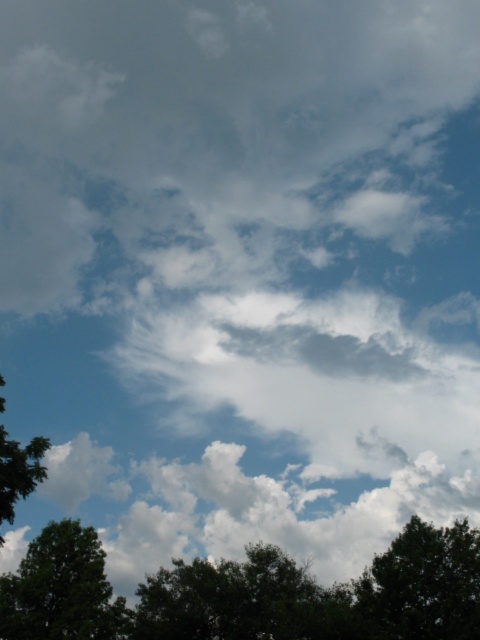
You are standing in a field looking up at the sky. You notice two green leafy trees in the distance. One is labeled as the green leafy tree at lower left and the other as the green leafy tree at left. Which tree would block your view of the sky if you stand directly in front of it?

The green leafy tree at lower left is below the green leafy tree at left, so if you stand directly in front of the green leafy tree at lower left, it would block your view of the sky more than the one above it.

You are standing in a field looking up at the sky. You notice two green leafy trees in the foreground. Which tree is closer to you, the green leafy tree at lower center or the green leafy tree at lower right?

The green leafy tree at lower center is closer to you because it is in front of the green leafy tree at lower right.